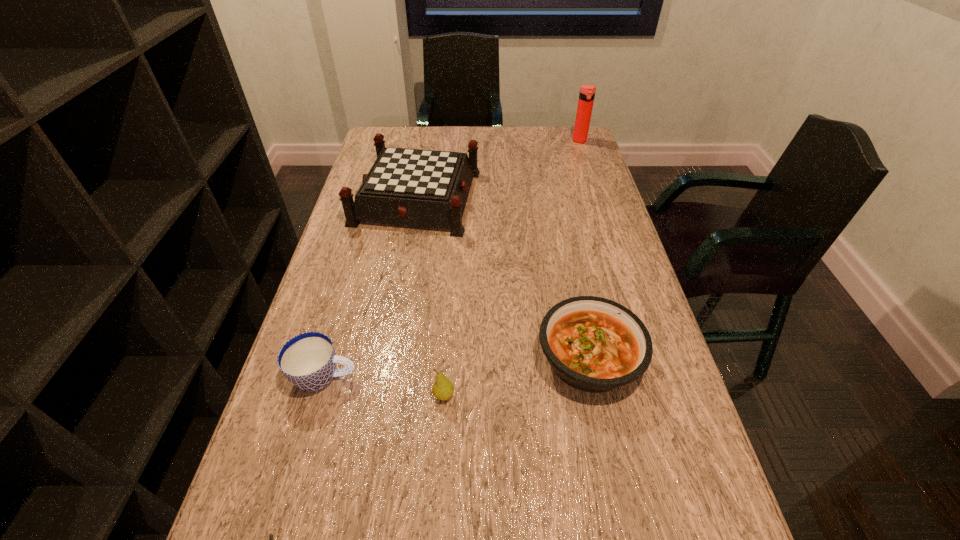
Locate which object is the closest to the stew. Please provide its 2D coordinates. Your answer should be formatted as a tuple, i.e. [(x, y)], where the tuple contains the x and y coordinates of a point satisfying the conditions above.

[(443, 388)]

Select which object is the second closest to the pear. Please provide its 2D coordinates. Your answer should be formatted as a tuple, i.e. [(x, y)], where the tuple contains the x and y coordinates of a point satisfying the conditions above.

[(593, 344)]

Find the location of a particular element. The height and width of the screenshot is (540, 960). vacant space that satisfies the following two spatial constraints: 1. on the side of the cup with the handle; 2. on the right side of the pear is located at coordinates (320, 396).

Where is `vacant space that satisfies the following two spatial constraints: 1. on the front side of the second tallest object; 2. on the side of the cup with the handle`? The image size is (960, 540). vacant space that satisfies the following two spatial constraints: 1. on the front side of the second tallest object; 2. on the side of the cup with the handle is located at coordinates (386, 377).